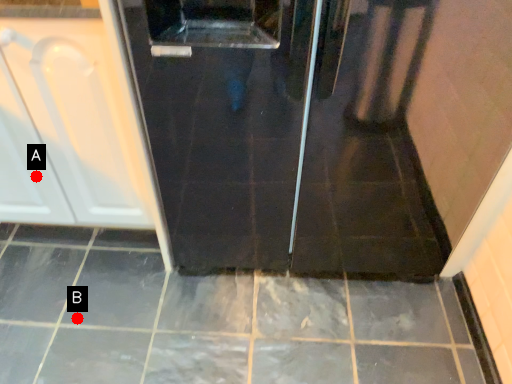
Question: Two points are circled on the image, labeled by A and B beside each circle. Which of the following is the closest to the observer?

Choices:
 (A) A is closer
 (B) B is closer

Answer: (A)